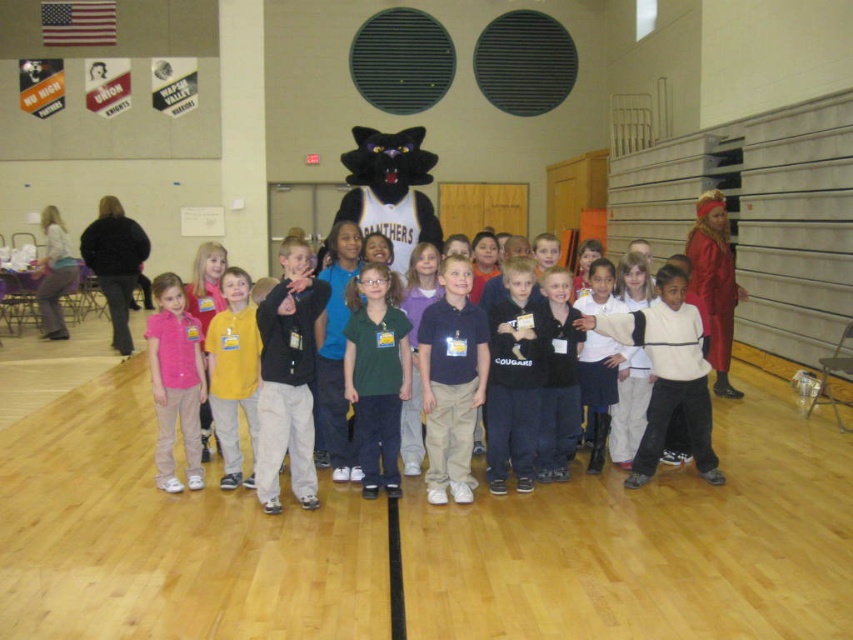
In the scene shown: You are a photographer setting up for a group photo in the school gym. You notice two shirts in the center of the group, a dark blue shirt at center and a pink fabric shirt at center. Which shirt should you adjust to make sure both shirts are equally visible in the photo?

The dark blue shirt at center occupies less space than the pink fabric shirt at center, so you should adjust the pink fabric shirt at center to reduce its size or position to balance visibility.